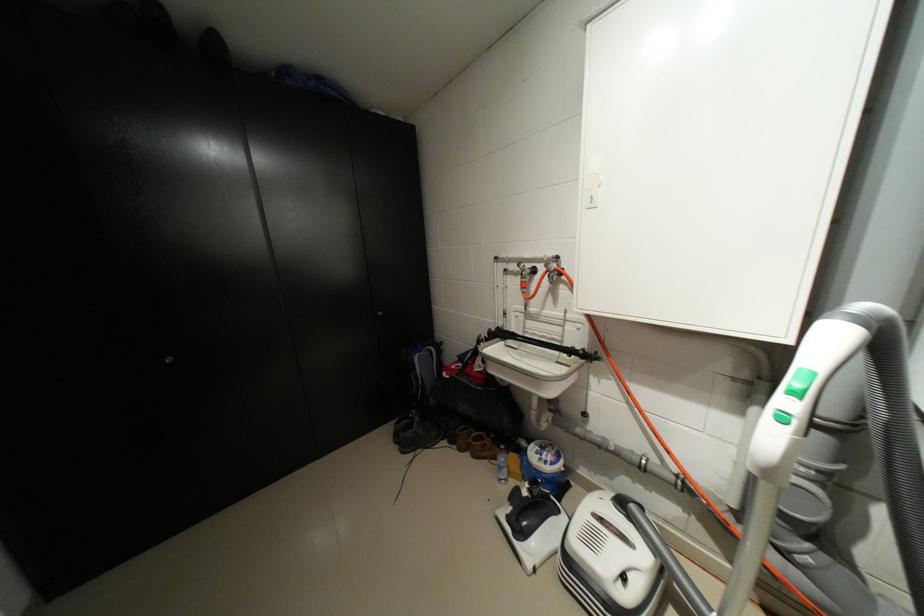
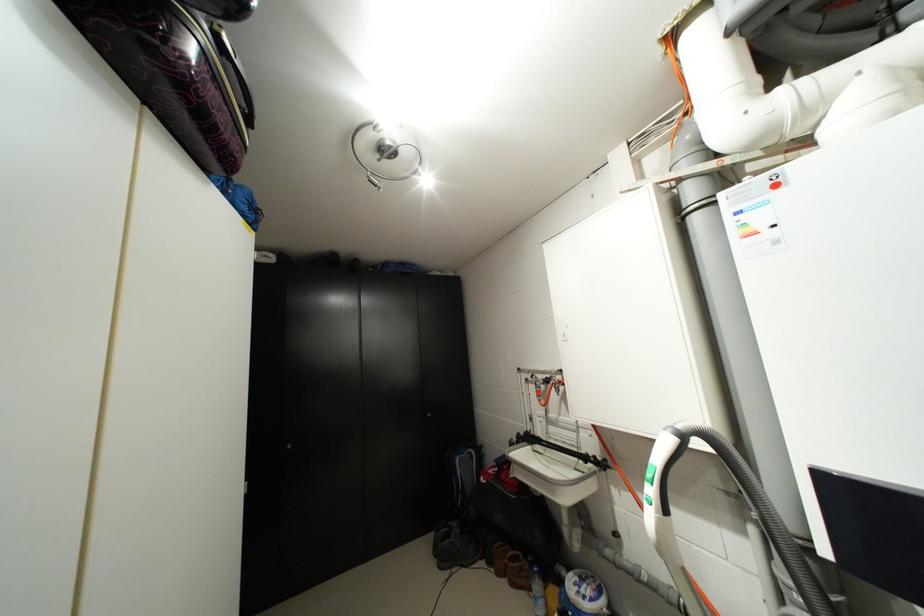
In the second image, find the point that corresponds to pixel 560 464 in the first image.

(599, 600)